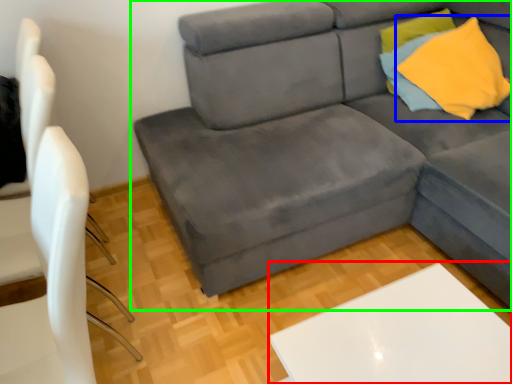
Question: Based on their relative distances, which object is nearer to table (highlighted by a red box)? Choose from throw pillow (highlighted by a blue box) and studio couch (highlighted by a green box).

Choices:
 (A) throw pillow
 (B) studio couch

Answer: (B)